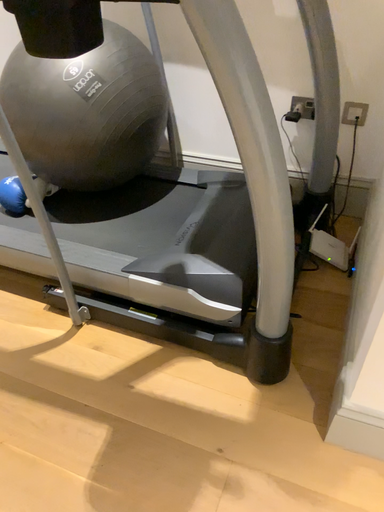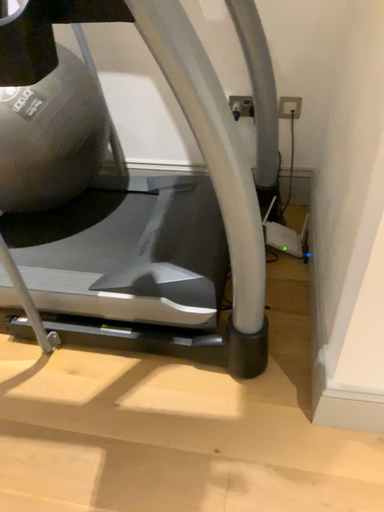
Question: How did the camera likely rotate when shooting the video?

Choices:
 (A) rotated right
 (B) rotated left

Answer: (A)